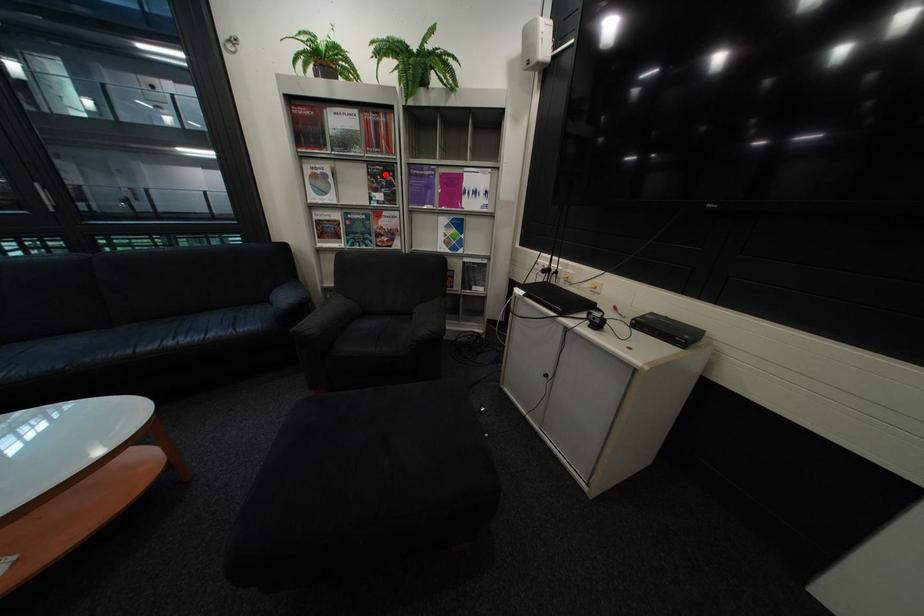
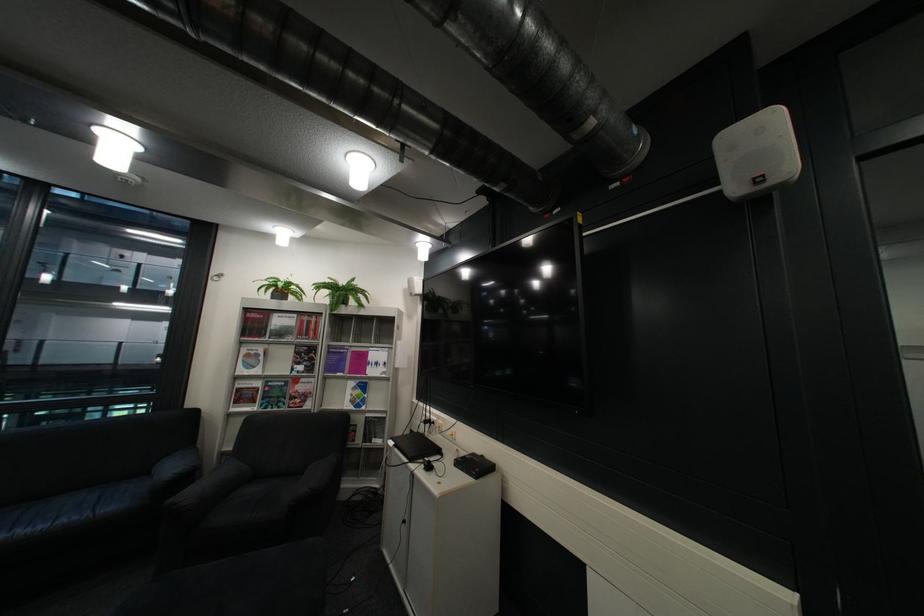
Question: I am providing you with two images of the same scene from different viewpoints. A red point is marked on the first image. Can you still see the location of the red point in image 2?

Choices:
 (A) Yes
 (B) No

Answer: (A)